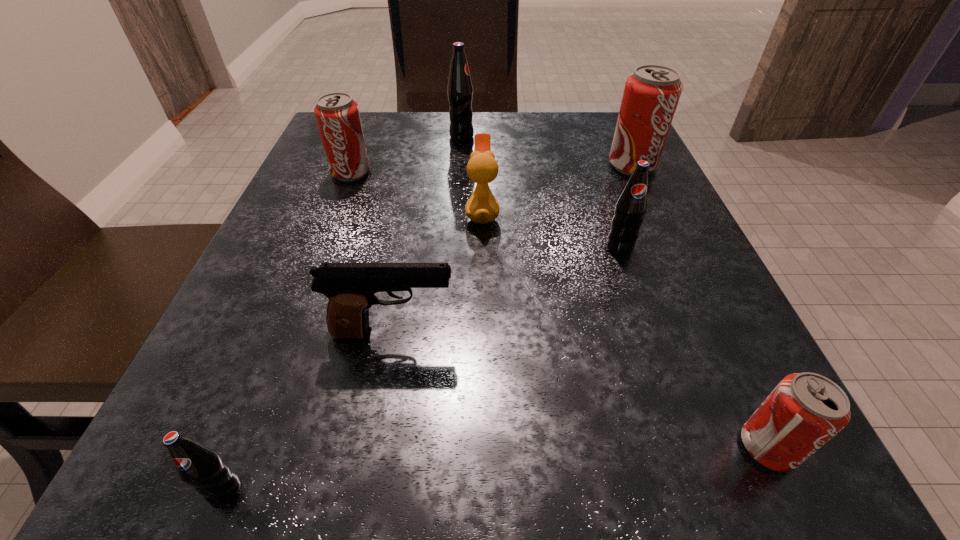
This screenshot has width=960, height=540. Identify the location of vacant space at the right edge of the desktop. (676, 239).

In order to click on vacant area at the far left corner of the desktop in this screenshot , I will do `click(377, 116)`.

Locate an element on the screen. The height and width of the screenshot is (540, 960). free location at the near right corner is located at coordinates point(670,454).

Find the location of `vacant space that is in between the pistol and the smallest black pop`. vacant space that is in between the pistol and the smallest black pop is located at coordinates (309, 412).

Find the location of a particular element. free spot between the smallest black pop and the black pistol is located at coordinates (309, 412).

The height and width of the screenshot is (540, 960). Identify the location of vacant area that lies between the nearest pink soda can and the nearest black pop. (496, 469).

At what (x,y) coordinates should I click in order to perform the action: click on vacant area that lies between the nearest black pop and the nearest pink soda can. Please return your answer as a coordinate pair (x, y). Looking at the image, I should click on (496, 469).

This screenshot has width=960, height=540. I want to click on free space between the second smallest pink soda can and the black pistol, so click(x=372, y=253).

Image resolution: width=960 pixels, height=540 pixels. I want to click on free space between the biggest pink soda can and the duck, so click(x=558, y=189).

Locate an element on the screen. vacant space in between the biggest pink soda can and the farthest object is located at coordinates point(547,151).